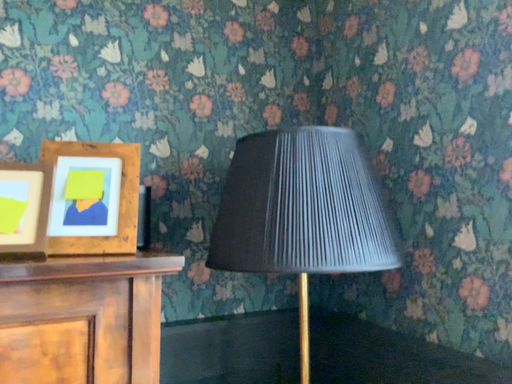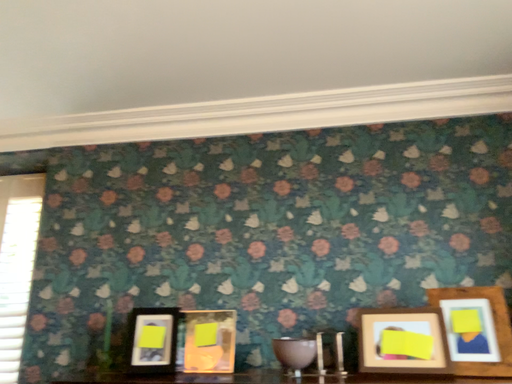
Question: How did the camera likely rotate when shooting the video?

Choices:
 (A) rotated upward
 (B) rotated downward

Answer: (A)